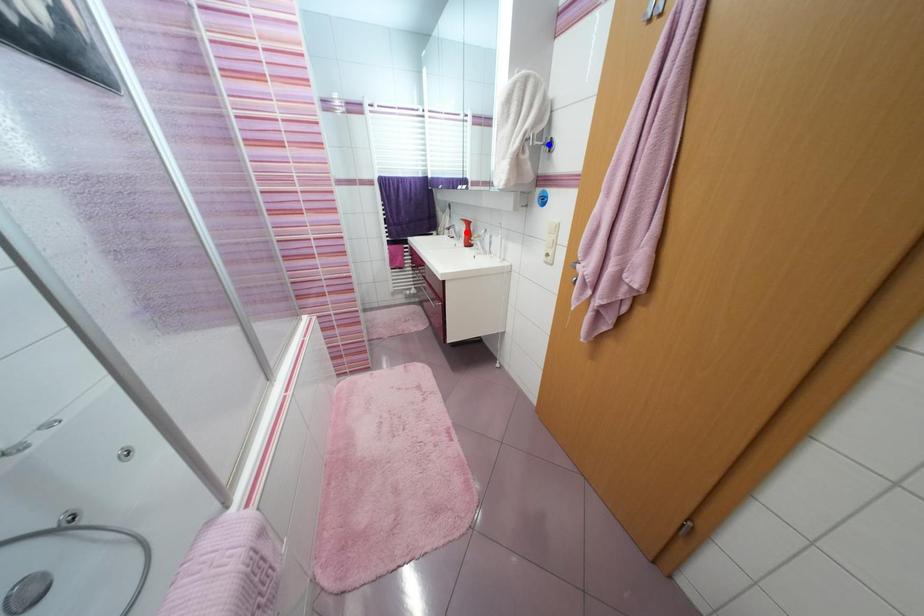
Question: Which of the two points in the image is closer to the camera?

Choices:
 (A) Blue point is closer.
 (B) Red point is closer.

Answer: (A)